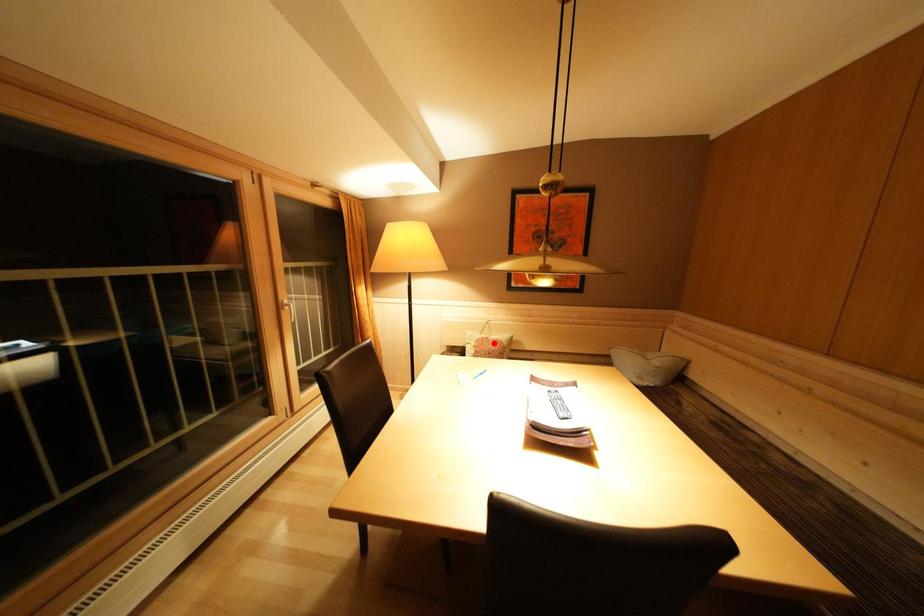
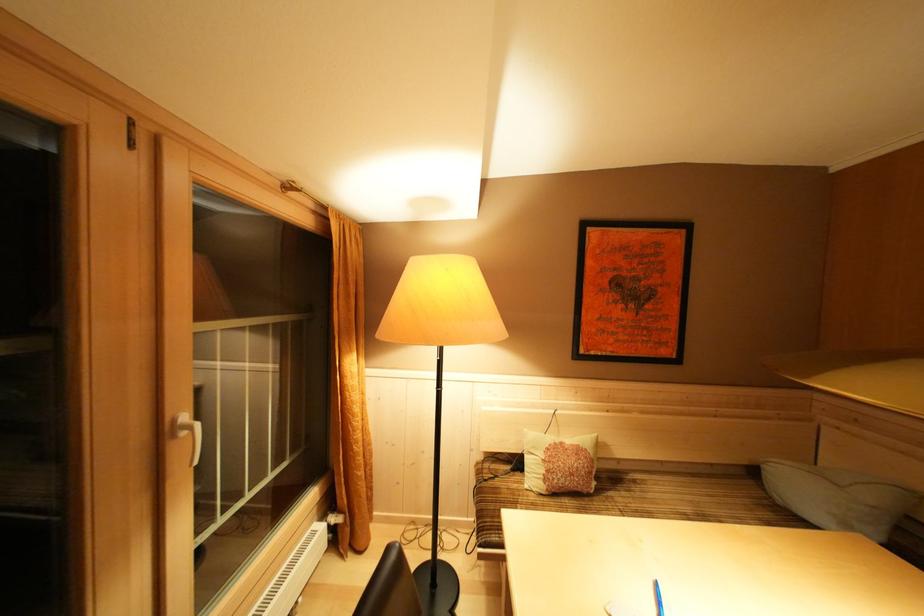
Question: I am providing you with two images of the same scene from different viewpoints. Image1 has a red point marked. In image2, the corresponding 3D location appears at what relative position? Reply with the corresponding letter.

Choices:
 (A) Closer
 (B) Farther

Answer: (B)